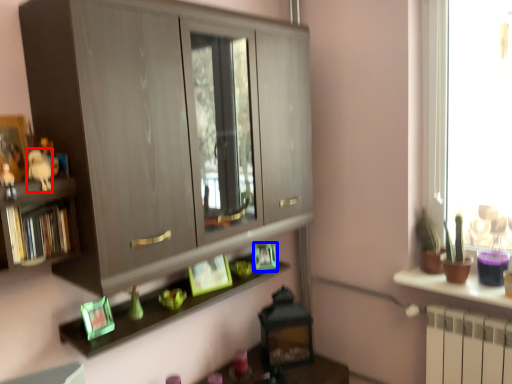
Question: Among these objects, which one is nearest to the camera, animal (highlighted by a red box) or picture frame (highlighted by a blue box)?

Choices:
 (A) animal
 (B) picture frame

Answer: (A)